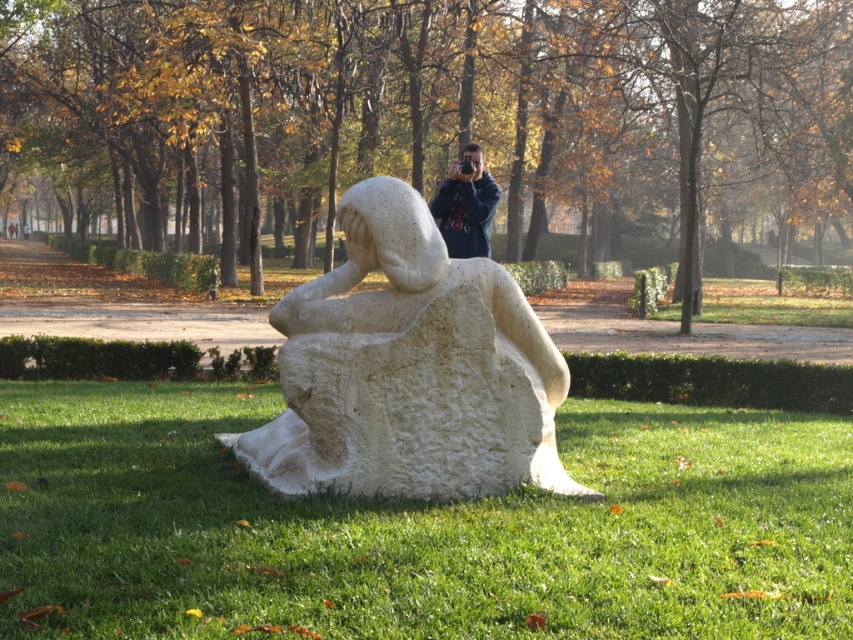
Can you confirm if white stone sculpture at center is shorter than dark blue jacket at center?

No.

What are the coordinates of `white stone sculpture at center` in the screenshot? It's located at (409, 371).

Locate an element on the screen. This screenshot has width=853, height=640. white stone sculpture at center is located at coordinates (409, 371).

Between green grass at lower center and white stone sculpture at center, which one is positioned higher?

Positioned higher is white stone sculpture at center.

Identify the location of green grass at lower center. (418, 528).

Is point (138, 538) positioned in front of point (341, 381)?

Yes, point (138, 538) is in front of point (341, 381).

In order to click on green grass at lower center in this screenshot , I will do tap(418, 528).

Who is positioned more to the left, green grass at lower center or dark blue jacket at center?

From the viewer's perspective, green grass at lower center appears more on the left side.

Is green grass at lower center positioned behind dark blue jacket at center?

No, it is not.

Measure the distance between green grass at lower center and camera.

The distance of green grass at lower center from camera is 22.25 feet.

You are a GUI agent. You are given a task and a screenshot of the screen. Output one action in this format:
    pyautogui.click(x=<x>, y=<y>)
    Task: Click on the green grass at lower center
    
    Given the screenshot: What is the action you would take?
    pyautogui.click(x=418, y=528)